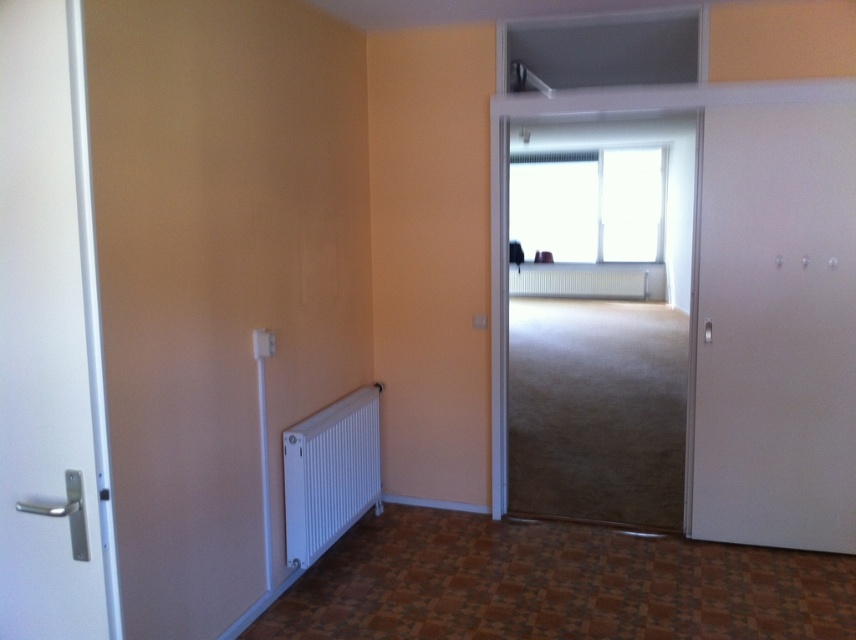
Which is behind, point (699, 467) or point (336, 403)?

Point (336, 403)

Between white matte door at right and white metallic radiator at lower left, which one is positioned higher?

white matte door at right

The height and width of the screenshot is (640, 856). What are the coordinates of `white matte door at right` in the screenshot? It's located at pyautogui.click(x=773, y=326).

Between point (318, 440) and point (609, 289), which one is positioned behind?

The point (609, 289) is more distant.

Does white metallic radiator at lower left have a greater width compared to white matte radiator at center?

No, white metallic radiator at lower left is not wider than white matte radiator at center.

Looking at this image, who is more forward, (310,532) or (575,289)?

Positioned in front is point (310,532).

I want to click on white metallic radiator at lower left, so click(330, 474).

Does point (27, 67) lie behind point (295, 488)?

No, it is not.

The image size is (856, 640). What do you see at coordinates (51, 340) in the screenshot? I see `white matte door at left` at bounding box center [51, 340].

Who is more forward, (82, 465) or (316, 554)?

Point (82, 465) is in front.

Where is `white matte door at left`? This screenshot has height=640, width=856. white matte door at left is located at coordinates (51, 340).